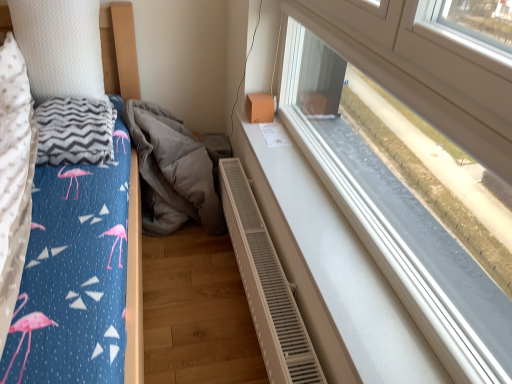
Question: Is white textured radiator at lower center surrounding white textured pillow at upper left?

Choices:
 (A) yes
 (B) no

Answer: (B)

Question: Are white textured radiator at lower center and white textured pillow at upper left located far from each other?

Choices:
 (A) yes
 (B) no

Answer: (B)

Question: From the image's perspective, is white textured radiator at lower center on white textured pillow at upper left?

Choices:
 (A) yes
 (B) no

Answer: (B)

Question: Considering the relative positions of white textured radiator at lower center and white textured pillow at upper left in the image provided, is white textured radiator at lower center to the left of white textured pillow at upper left from the viewer's perspective?

Choices:
 (A) yes
 (B) no

Answer: (B)

Question: Does white textured radiator at lower center lie behind white textured pillow at upper left?

Choices:
 (A) yes
 (B) no

Answer: (B)

Question: Considering the positions of gray zigzag-patterned blanket at left and white textured radiator at lower center in the image, is gray zigzag-patterned blanket at left bigger or smaller than white textured radiator at lower center?

Choices:
 (A) small
 (B) big

Answer: (A)

Question: Considering the positions of gray zigzag-patterned blanket at left and white textured radiator at lower center in the image, is gray zigzag-patterned blanket at left wider or thinner than white textured radiator at lower center?

Choices:
 (A) thin
 (B) wide

Answer: (B)

Question: From the image's perspective, relative to white textured radiator at lower center, is gray zigzag-patterned blanket at left above or below?

Choices:
 (A) above
 (B) below

Answer: (A)

Question: Is gray zigzag-patterned blanket at left taller or shorter than white textured radiator at lower center?

Choices:
 (A) tall
 (B) short

Answer: (B)

Question: From a real-world perspective, is gray zigzag-patterned blanket at left physically located above or below white textured pillow at upper left?

Choices:
 (A) below
 (B) above

Answer: (A)

Question: From the image's perspective, is gray zigzag-patterned blanket at left positioned above or below white textured pillow at upper left?

Choices:
 (A) above
 (B) below

Answer: (B)

Question: Considering their positions, is gray zigzag-patterned blanket at left located in front of or behind white textured pillow at upper left?

Choices:
 (A) behind
 (B) front

Answer: (B)

Question: Is gray zigzag-patterned blanket at left to the left or to the right of white textured pillow at upper left in the image?

Choices:
 (A) right
 (B) left

Answer: (A)

Question: Considering the positions of gray fabric at lower center and white textured radiator at lower center in the image, is gray fabric at lower center taller or shorter than white textured radiator at lower center?

Choices:
 (A) tall
 (B) short

Answer: (A)

Question: In terms of size, does gray fabric at lower center appear bigger or smaller than white textured radiator at lower center?

Choices:
 (A) big
 (B) small

Answer: (A)